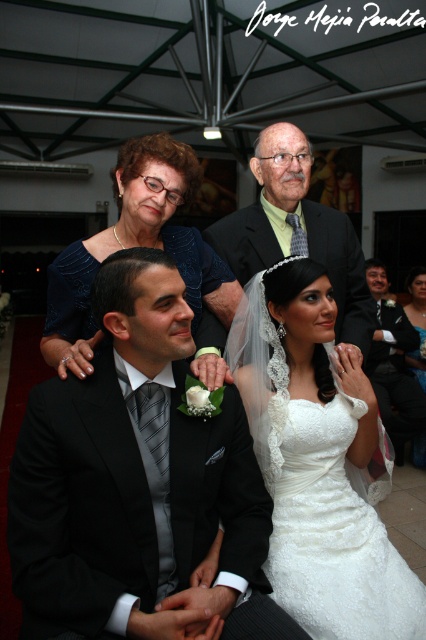
Question: Is black satin suit at center thinner than matte black suit at upper center?

Choices:
 (A) yes
 (B) no

Answer: (A)

Question: Which point is closer to the camera taking this photo?

Choices:
 (A) (408, 384)
 (B) (161, 168)
 (C) (256, 163)
 (D) (385, 621)

Answer: (D)

Question: Does black satin suit at center have a lesser width compared to white satin dress at center?

Choices:
 (A) yes
 (B) no

Answer: (B)

Question: Observing the image, what is the correct spatial positioning of black satin suit at center in reference to white satin dress at center?

Choices:
 (A) right
 (B) left

Answer: (B)

Question: Which of the following is the farthest from the observer?

Choices:
 (A) matte black suit at upper center
 (B) white lace dress at center

Answer: (A)

Question: Which point is farther to the camera?

Choices:
 (A) white satin dress at center
 (B) white lace dress at center
 (C) black satin suit at center

Answer: (A)